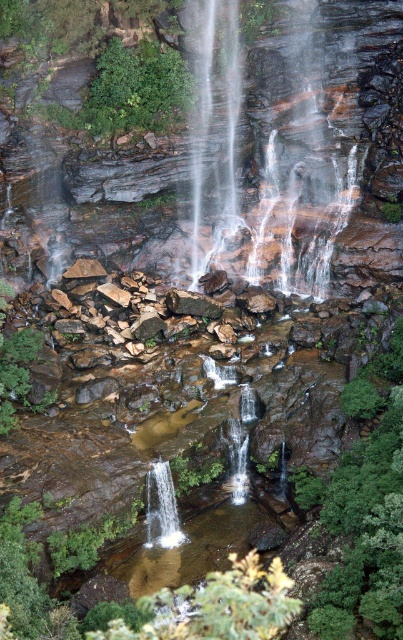
You are standing at the edge of the pool and want to cross to the other side. There is a large rock in the water. Which direction should you walk to avoid the white smooth waterfall at center and reach the clear water at center?

You should walk to the right of the white smooth waterfall at center to reach the clear water at center, as the clear water at center is located to the right of the waterfall.

You are standing at the edge of the pool and want to cross to the other side. The clear water at center is deeper than the white smooth waterfall at center. Which path should you choose to avoid getting wet?

You should cross through the clear water at center because it is deeper than the white smooth waterfall at center, making it safer for walking.